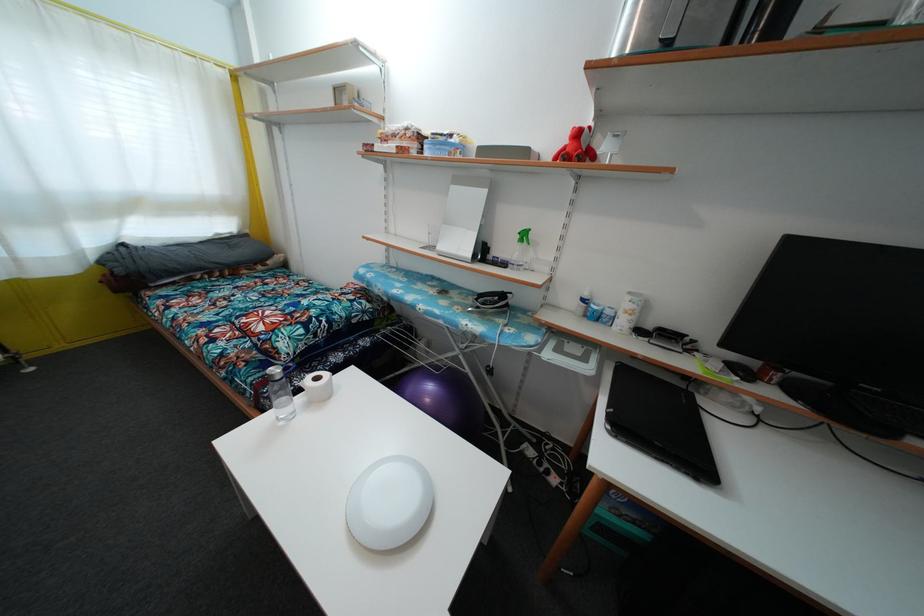
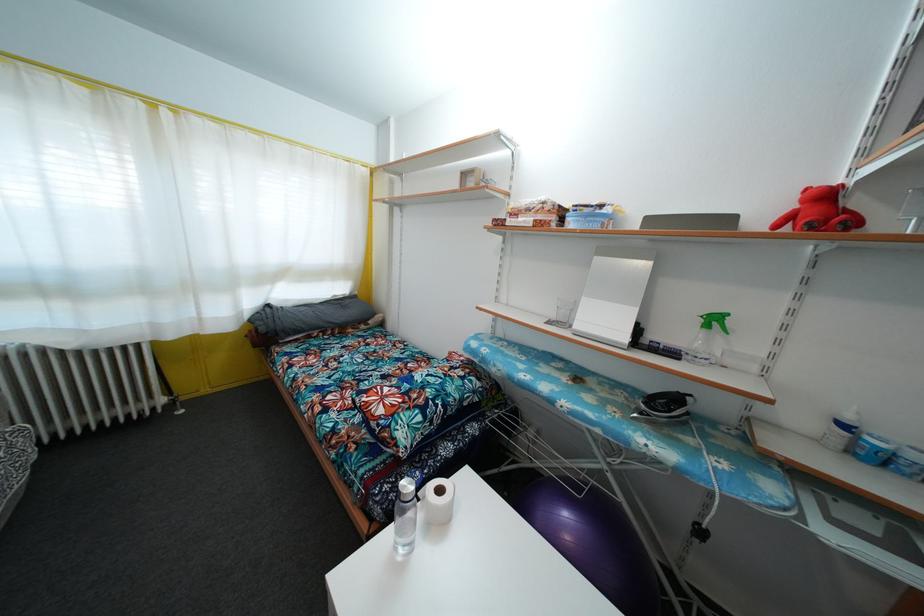
Where in the second image is the point corresponding to point (570, 148) from the first image?

(800, 213)